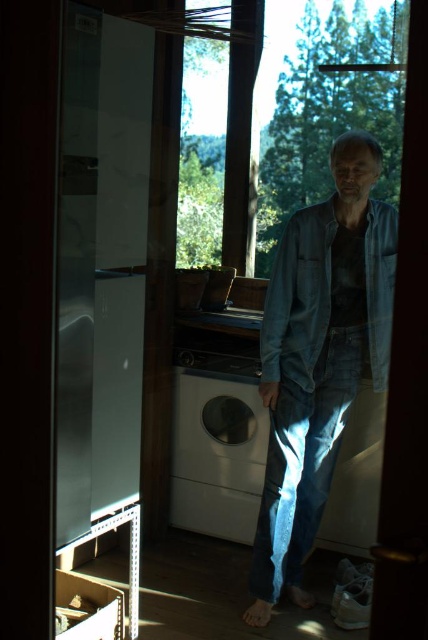
Question: Does denim shirt at center appear on the left side of white matte washing machine at center?

Choices:
 (A) no
 (B) yes

Answer: (A)

Question: Estimate the real-world distances between objects in this image. Which object is closer to the white matte washing machine at center?

Choices:
 (A) faded denim jacket at lower right
 (B) denim shirt at center

Answer: (B)

Question: Can you confirm if white matte washing machine at center is positioned below faded denim jacket at lower right?

Choices:
 (A) yes
 (B) no

Answer: (A)

Question: Which object appears closest to the camera in this image?

Choices:
 (A) faded denim jacket at lower right
 (B) denim shirt at center
 (C) white matte washing machine at center

Answer: (B)

Question: In this image, where is denim shirt at center located relative to white matte washing machine at center?

Choices:
 (A) left
 (B) right

Answer: (B)

Question: Which of the following is the farthest from the observer?

Choices:
 (A) faded denim jacket at lower right
 (B) denim shirt at center

Answer: (A)